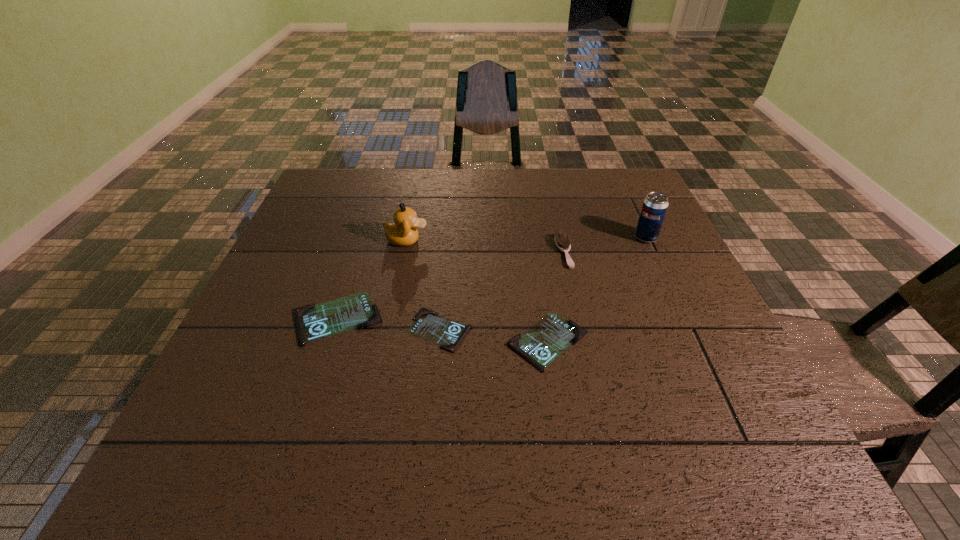
Identify the location of free space that satisfies the following two spatial constraints: 1. on the front side of the rightmost identity card; 2. on the right side of the leftmost identity card. (329, 342).

Identify the location of blank space that satisfies the following two spatial constraints: 1. on the back side of the rightmost object; 2. on the right side of the shortest identity card. This screenshot has width=960, height=540. (448, 238).